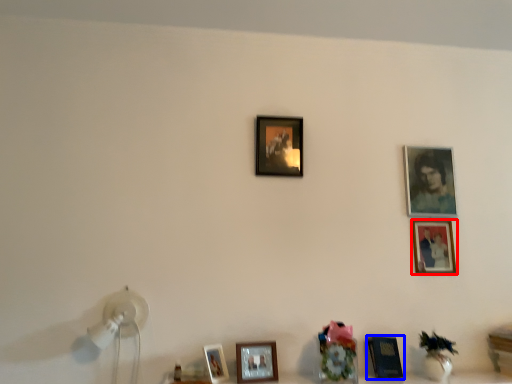
Question: Which point is further to the camera, picture frame (highlighted by a red box) or picture frame (highlighted by a blue box)?

Choices:
 (A) picture frame
 (B) picture frame

Answer: (A)